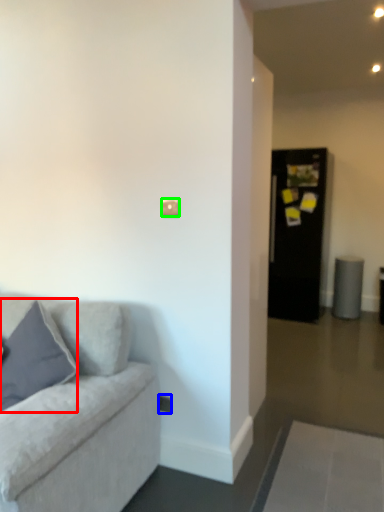
Question: Considering the real-world distances, which object is closest to pillow (highlighted by a red box)? electric outlet (highlighted by a blue box) or light switch (highlighted by a green box).

Choices:
 (A) electric outlet
 (B) light switch

Answer: (A)